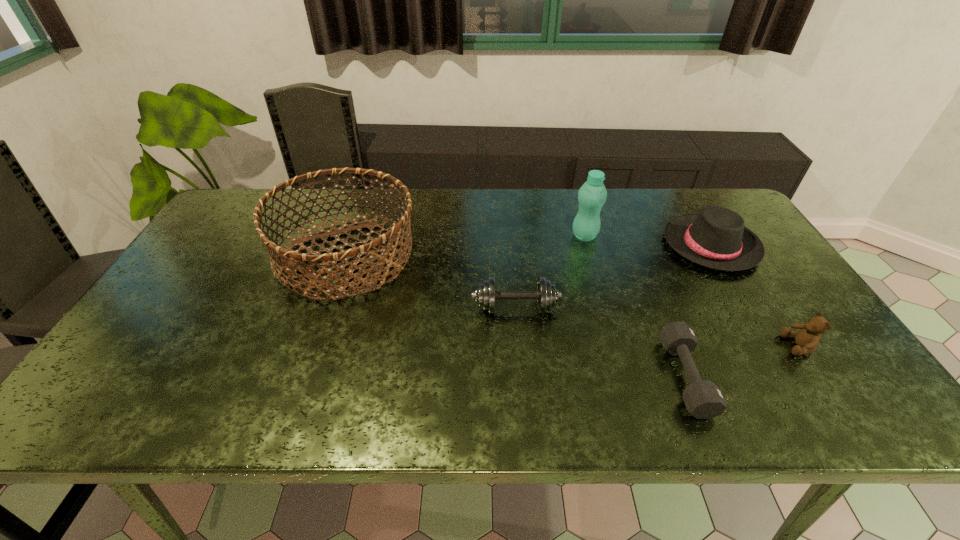
Choose which object is the nearest neighbor to the second tallest object. Please provide its 2D coordinates. Your answer should be formatted as a tuple, i.e. [(x, y)], where the tuple contains the x and y coordinates of a point satisfying the conditions above.

[(546, 295)]

Choose which object is the nearest neighbor to the farther dumbbell. Please provide its 2D coordinates. Your answer should be formatted as a tuple, i.e. [(x, y)], where the tuple contains the x and y coordinates of a point satisfying the conditions above.

[(288, 256)]

The width and height of the screenshot is (960, 540). In order to click on free spot that satisfies the following two spatial constraints: 1. on the front-facing side of the teddy bear; 2. on the front side of the shortest object in this screenshot , I will do `click(820, 377)`.

At what (x,y) coordinates should I click in order to perform the action: click on free point that satisfies the following two spatial constraints: 1. on the front side of the shortest object; 2. on the right side of the taller dumbbell. Please return your answer as a coordinate pair (x, y). The width and height of the screenshot is (960, 540). Looking at the image, I should click on (521, 377).

I want to click on free space that satisfies the following two spatial constraints: 1. on the back side of the dress hat; 2. on the right side of the leftmost object, so click(x=350, y=245).